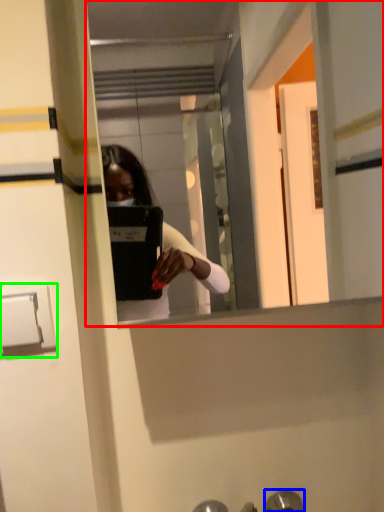
Question: Which is nearer to the mirror (highlighted by a red box)? door handle (highlighted by a blue box) or door handle (highlighted by a green box).

Choices:
 (A) door handle
 (B) door handle

Answer: (A)